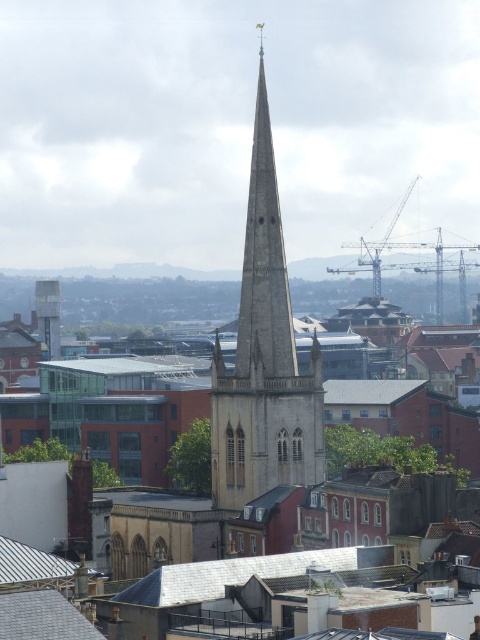
You are standing in the city square and want to take a photo of both the gray slate roof at center and the metallic gray tower at center. Which one should you point your camera at first to ensure both are in the frame?

You should point your camera at the metallic gray tower at center first because the gray slate roof at center is below it, so capturing the tower will naturally include the roof in the frame.

You are a city planner reviewing the architectural plans of the city. You need to determine which gray slate roof is positioned higher in elevation between the gray slate roof at center and the gray slate roof at lower left. Which one is taller?

The gray slate roof at center is taller than the gray slate roof at lower left according to the description.